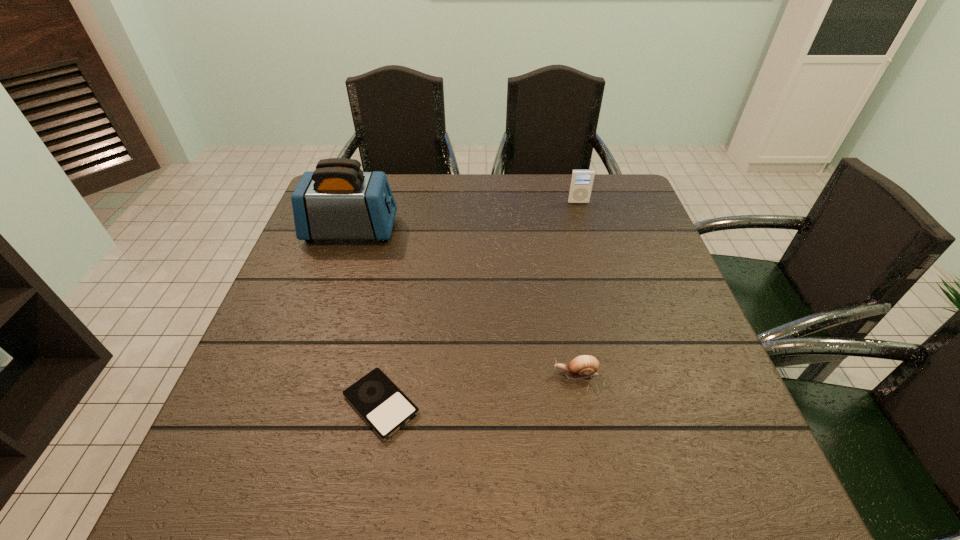
Identify the location of the third nearest object. The image size is (960, 540). (338, 201).

The image size is (960, 540). I want to click on the tallest object, so click(338, 201).

At what (x,y) coordinates should I click in order to perform the action: click on the right iPod. Please return your answer as a coordinate pair (x, y). This screenshot has width=960, height=540. Looking at the image, I should click on (581, 183).

Where is `the farther iPod`? The height and width of the screenshot is (540, 960). the farther iPod is located at coordinates (581, 183).

The image size is (960, 540). I want to click on the third tallest object, so click(x=583, y=366).

Locate an element on the screen. This screenshot has height=540, width=960. escargot is located at coordinates (583, 366).

Where is `the left iPod`? This screenshot has width=960, height=540. the left iPod is located at coordinates (385, 408).

You are a GUI agent. You are given a task and a screenshot of the screen. Output one action in this format:
    pyautogui.click(x=<x>, y=<y>)
    Task: Click on the shorter iPod
    This screenshot has width=960, height=540.
    Given the screenshot: What is the action you would take?
    pyautogui.click(x=385, y=408)

Identify the location of blank area located on the front-facing side of the tallest object. (517, 231).

Where is `vacant space situated 0.330m on the front-facing side of the second tallest object`? The width and height of the screenshot is (960, 540). vacant space situated 0.330m on the front-facing side of the second tallest object is located at coordinates (600, 280).